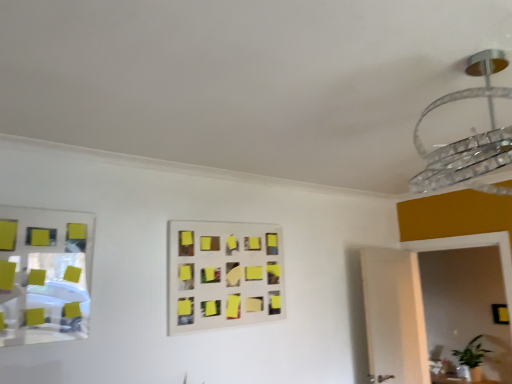
Question: Does black matte square at lower right turn towards clear glass chandelier at upper right?

Choices:
 (A) no
 (B) yes

Answer: (B)

Question: Would you say black matte square at lower right is outside clear glass chandelier at upper right?

Choices:
 (A) yes
 (B) no

Answer: (A)

Question: Considering the relative sizes of black matte square at lower right and clear glass chandelier at upper right in the image provided, is black matte square at lower right shorter than clear glass chandelier at upper right?

Choices:
 (A) yes
 (B) no

Answer: (A)

Question: Considering the relative sizes of black matte square at lower right and clear glass chandelier at upper right in the image provided, is black matte square at lower right wider than clear glass chandelier at upper right?

Choices:
 (A) yes
 (B) no

Answer: (B)

Question: Does black matte square at lower right have a lesser width compared to clear glass chandelier at upper right?

Choices:
 (A) yes
 (B) no

Answer: (A)

Question: Considering the positions of point (470, 162) and point (59, 210), is point (470, 162) closer or farther from the camera than point (59, 210)?

Choices:
 (A) closer
 (B) farther

Answer: (A)

Question: Would you say clear glass chandelier at upper right is inside or outside metallic reflective mirror at left?

Choices:
 (A) inside
 (B) outside

Answer: (B)

Question: Is clear glass chandelier at upper right to the left or to the right of metallic reflective mirror at left in the image?

Choices:
 (A) right
 (B) left

Answer: (A)

Question: From a real-world perspective, is clear glass chandelier at upper right above or below metallic reflective mirror at left?

Choices:
 (A) below
 (B) above

Answer: (B)

Question: Do you think yellow sticky notes at center is within black matte square at lower right, or outside of it?

Choices:
 (A) outside
 (B) inside

Answer: (A)

Question: From their relative heights in the image, would you say yellow sticky notes at center is taller or shorter than black matte square at lower right?

Choices:
 (A) short
 (B) tall

Answer: (B)

Question: In the image, is yellow sticky notes at center positioned in front of or behind black matte square at lower right?

Choices:
 (A) front
 (B) behind

Answer: (A)

Question: Does point (244, 279) appear closer or farther from the camera than point (496, 319)?

Choices:
 (A) farther
 (B) closer

Answer: (B)

Question: In terms of width, does black matte square at lower right look wider or thinner when compared to metallic reflective mirror at left?

Choices:
 (A) thin
 (B) wide

Answer: (A)

Question: From a real-world perspective, is black matte square at lower right physically located above or below metallic reflective mirror at left?

Choices:
 (A) below
 (B) above

Answer: (A)